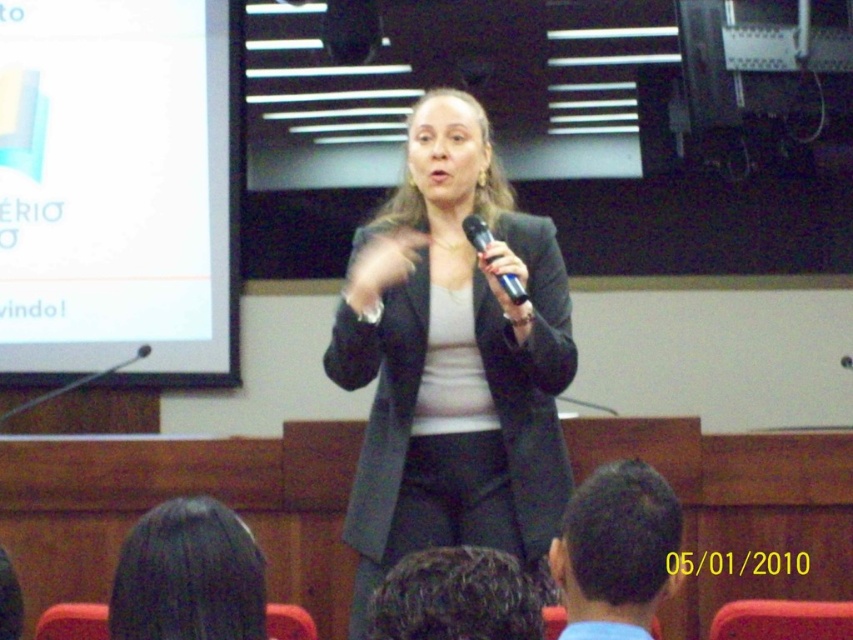
Question: Among these objects, which one is farthest from the camera?

Choices:
 (A) matte black blazer at center
 (B) dark hair at lower left
 (C) white glossy projection screen at upper left
 (D) dark brown leather chair at lower left

Answer: (C)

Question: Observing the image, what is the correct spatial positioning of white glossy projection screen at upper left in reference to dark brown leather chair at lower left?

Choices:
 (A) above
 (B) below

Answer: (A)

Question: Is white glossy projection screen at upper left above dark hair at lower left?

Choices:
 (A) no
 (B) yes

Answer: (B)

Question: Estimate the real-world distances between objects in this image. Which object is farther from the matte black blazer at center?

Choices:
 (A) white glossy projection screen at upper left
 (B) black metallic microphone at center
 (C) dark curly hair at lower center

Answer: (A)

Question: Is dark hair at lower left above dark brown leather chair at lower left?

Choices:
 (A) no
 (B) yes

Answer: (B)

Question: Among these objects, which one is farthest from the camera?

Choices:
 (A) dark hair at lower left
 (B) black metallic microphone at center
 (C) dark curly hair at lower center
 (D) blue fabric head at lower center

Answer: (B)